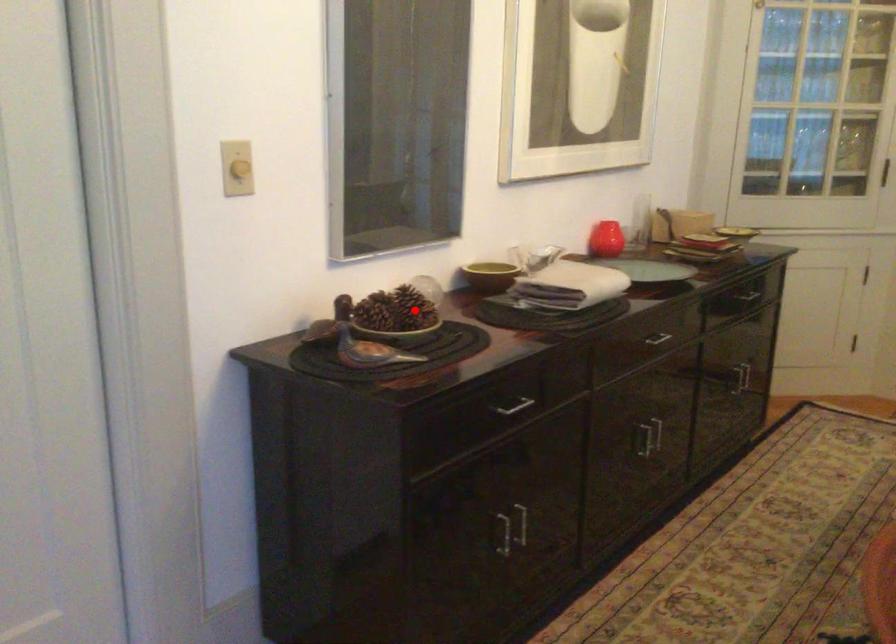
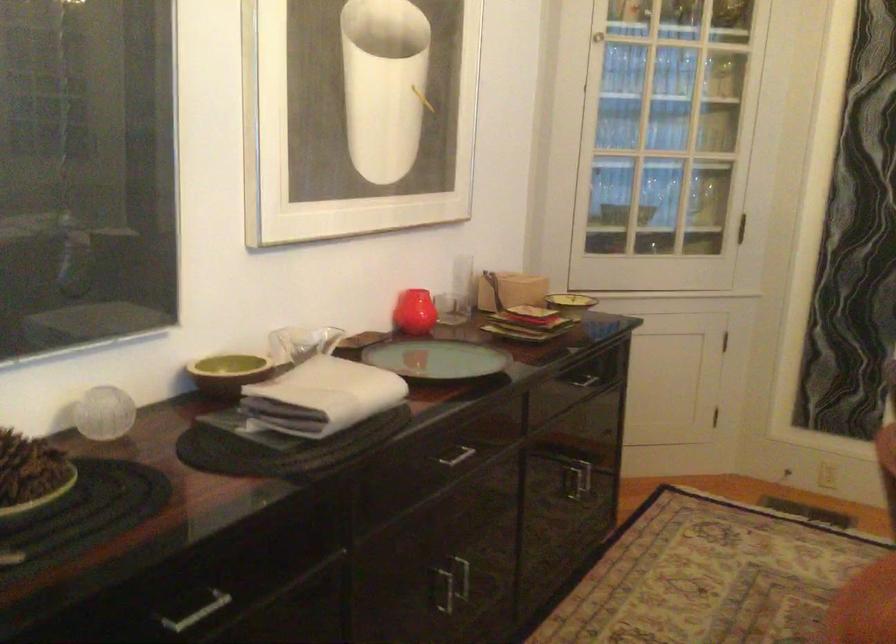
Question: I am providing you with two images of the same scene from different viewpoints. A red point is shown in image1. For the corresponding object point in image2, is it positioned nearer or farther from the camera?

Choices:
 (A) Nearer
 (B) Farther

Answer: (A)